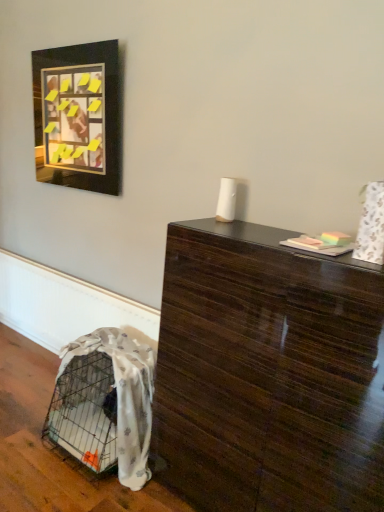
Question: Is white textured blanket at lower left taller than black matte picture frame at upper left?

Choices:
 (A) yes
 (B) no

Answer: (B)

Question: From the image's perspective, does white textured blanket at lower left appear lower than black matte picture frame at upper left?

Choices:
 (A) yes
 (B) no

Answer: (A)

Question: From the image's perspective, is white textured blanket at lower left above black matte picture frame at upper left?

Choices:
 (A) no
 (B) yes

Answer: (A)

Question: Does white textured blanket at lower left turn towards black matte picture frame at upper left?

Choices:
 (A) yes
 (B) no

Answer: (B)

Question: Can you confirm if white textured blanket at lower left is bigger than black matte picture frame at upper left?

Choices:
 (A) yes
 (B) no

Answer: (A)

Question: Considering the positions of point (334, 324) and point (94, 55), is point (334, 324) closer or farther from the camera than point (94, 55)?

Choices:
 (A) farther
 (B) closer

Answer: (B)

Question: From a real-world perspective, is glossy dark wood table at center positioned above or below black matte picture frame at upper left?

Choices:
 (A) below
 (B) above

Answer: (A)

Question: In terms of height, does glossy dark wood table at center look taller or shorter compared to black matte picture frame at upper left?

Choices:
 (A) short
 (B) tall

Answer: (B)

Question: From the image's perspective, relative to black matte picture frame at upper left, is glossy dark wood table at center above or below?

Choices:
 (A) above
 (B) below

Answer: (B)

Question: Considering the positions of white textured blanket at lower left and glossy dark wood table at center in the image, is white textured blanket at lower left taller or shorter than glossy dark wood table at center?

Choices:
 (A) tall
 (B) short

Answer: (B)

Question: Is point (132, 393) closer or farther from the camera than point (339, 268)?

Choices:
 (A) closer
 (B) farther

Answer: (B)

Question: Is white textured blanket at lower left to the left or to the right of glossy dark wood table at center in the image?

Choices:
 (A) left
 (B) right

Answer: (A)

Question: From a real-world perspective, is white textured blanket at lower left physically located above or below glossy dark wood table at center?

Choices:
 (A) above
 (B) below

Answer: (B)

Question: From a real-world perspective, is glossy dark wood table at center positioned above or below white textured blanket at lower left?

Choices:
 (A) above
 (B) below

Answer: (A)

Question: Is glossy dark wood table at center to the left or to the right of white textured blanket at lower left in the image?

Choices:
 (A) right
 (B) left

Answer: (A)